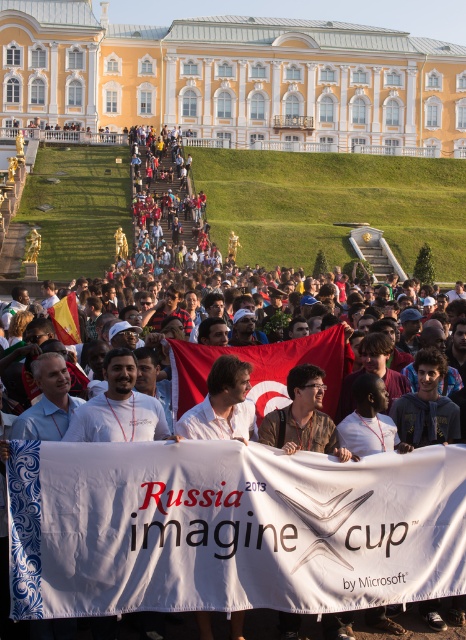
Question: Does yellow/white stone building at upper center have a smaller size compared to yellow fabric flag at center?

Choices:
 (A) yes
 (B) no

Answer: (B)

Question: Which of the following is the closest to the observer?

Choices:
 (A) yellow/white stone building at upper center
 (B) red fabric flag at center
 (C) yellow fabric flag at center

Answer: (B)

Question: Does yellow/white stone building at upper center have a larger size compared to red fabric flag at center?

Choices:
 (A) yes
 (B) no

Answer: (A)

Question: Does yellow/white stone building at upper center appear over yellow fabric flag at center?

Choices:
 (A) no
 (B) yes

Answer: (B)

Question: Estimate the real-world distances between objects in this image. Which object is closer to the yellow/white stone building at upper center?

Choices:
 (A) red fabric flag at center
 (B) yellow fabric flag at center

Answer: (B)

Question: Considering the real-world distances, which object is farthest from the yellow/white stone building at upper center?

Choices:
 (A) red fabric flag at center
 (B) yellow fabric flag at center

Answer: (A)